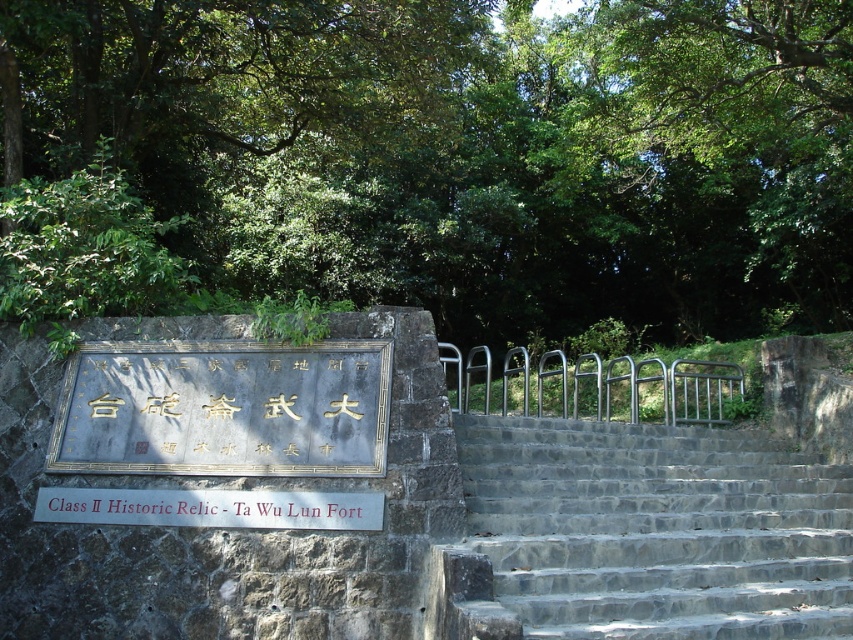
Question: From the image, what is the correct spatial relationship of gray stone stairs at center in relation to black metal sign at lower center?

Choices:
 (A) right
 (B) left

Answer: (A)

Question: Is silver metallic balustrade at center to the right of white wooden sign at center from the viewer's perspective?

Choices:
 (A) no
 (B) yes

Answer: (B)

Question: Which point appears closest to the camera in this image?

Choices:
 (A) (283, 401)
 (B) (521, 492)

Answer: (A)

Question: Which point is closer to the camera?

Choices:
 (A) white wooden sign at center
 (B) goldmaterial/textureplaque at center

Answer: (A)

Question: Which is nearer to the black metal sign at lower center?

Choices:
 (A) white wooden sign at center
 (B) silver metallic balustrade at center
 (C) goldmaterial/textureplaque at center
 (D) green leafy tree at upper center

Answer: (A)

Question: Does green leafy tree at upper center have a larger size compared to silver metallic balustrade at center?

Choices:
 (A) no
 (B) yes

Answer: (B)